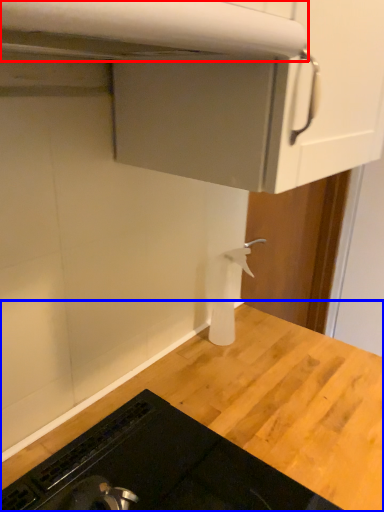
Question: Which object is closer to the camera taking this photo, exhaust hood (highlighted by a red box) or countertop (highlighted by a blue box)?

Choices:
 (A) exhaust hood
 (B) countertop

Answer: (A)